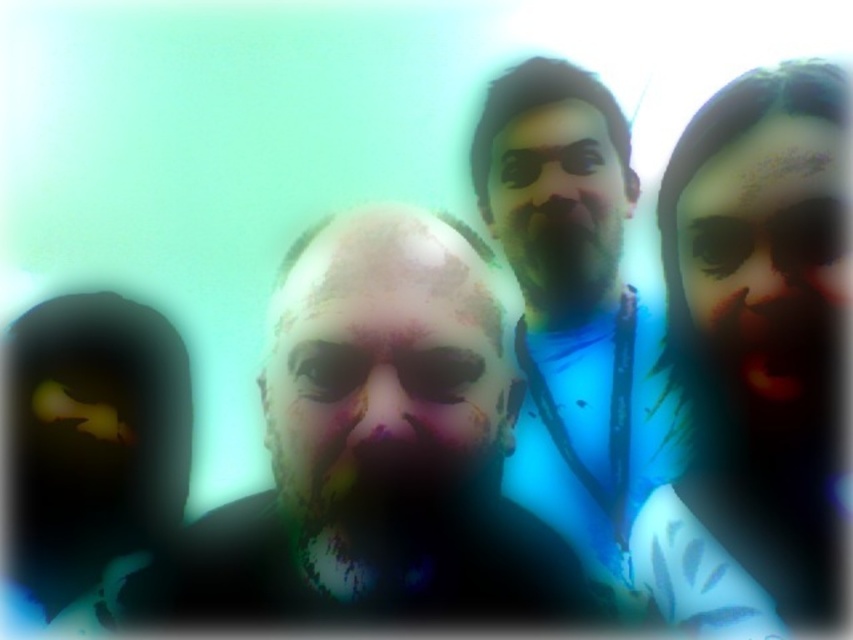
Which of these two, dark skin face at center or smooth skin face at right, stands shorter?

smooth skin face at right is shorter.

Is dark skin face at center wider than smooth skin face at right?

Yes, dark skin face at center is wider than smooth skin face at right.

Is point (297, 333) in front of point (724, 323)?

Yes, point (297, 333) is in front of point (724, 323).

This screenshot has width=853, height=640. I want to click on dark skin face at center, so click(x=373, y=448).

Does blue fabric shirt at center have a lesser width compared to smooth skin face at center?

Incorrect, blue fabric shirt at center's width is not less than smooth skin face at center's.

Is blue fabric shirt at center smaller than smooth skin face at center?

No.

Which is behind, point (541, 301) or point (514, 180)?

The point (541, 301) is behind.

The width and height of the screenshot is (853, 640). Find the location of `blue fabric shirt at center`. blue fabric shirt at center is located at coordinates (567, 294).

Does dark skin face at center have a greater height compared to smooth skin face at center?

Correct, dark skin face at center is much taller as smooth skin face at center.

Is point (553, 541) positioned after point (524, 141)?

No, it is in front of (524, 141).

Where is `dark skin face at center`? The width and height of the screenshot is (853, 640). dark skin face at center is located at coordinates (373, 448).